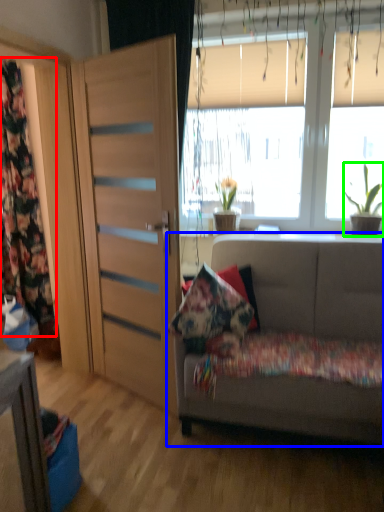
Question: Which object is the farthest from curtain (highlighted by a red box)? Choose among these: studio couch (highlighted by a blue box) or houseplant (highlighted by a green box).

Choices:
 (A) studio couch
 (B) houseplant

Answer: (B)